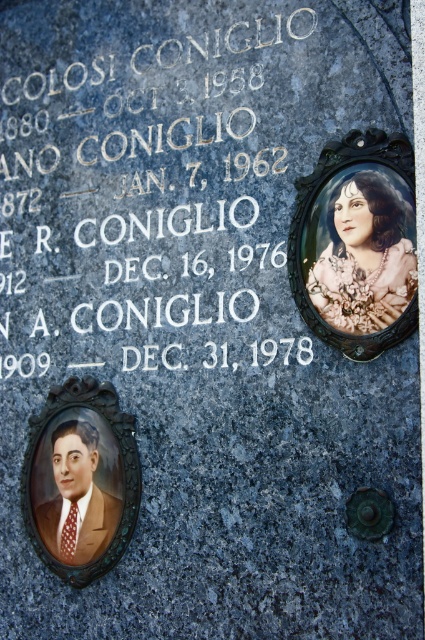
You are an archaeologist examining the tombstone and notice a point marked at coordinates (362, 252). Based on the tombstone layout, can you identify what is located at that point?

The point at (362, 252) corresponds to the pastel floral dress at upper right, which is part of the engraved portraits on the tombstone.

You are standing in front of the tombstone and notice two points marked on its surface. The first point is at coordinate (252, 234) and the second is at (351, 188). Which point is closer to you?

Point (252, 234) is closer to you because it is further to the viewer than point (351, 188).